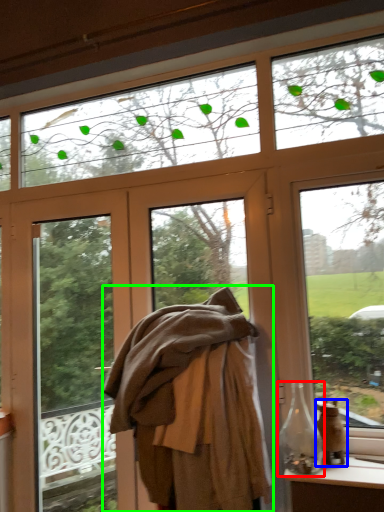
Question: Which is nearer to the bottle (highlighted by a red box)? glass vase (highlighted by a blue box) or clothing (highlighted by a green box).

Choices:
 (A) glass vase
 (B) clothing

Answer: (A)